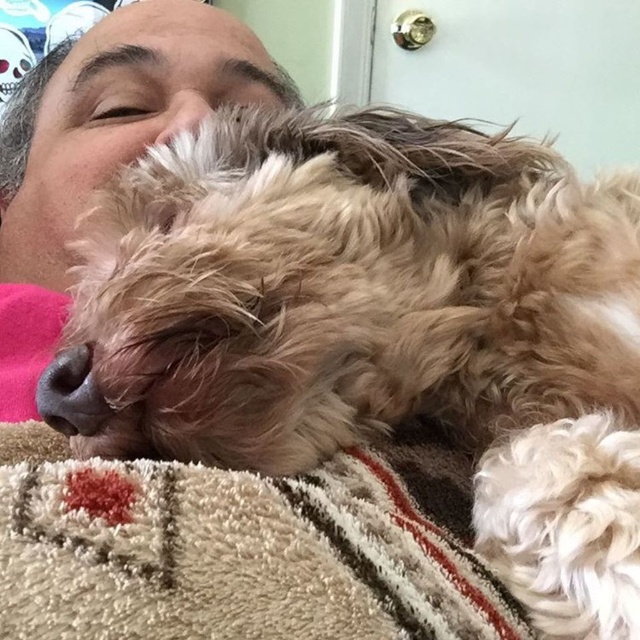
Can you confirm if white soft blanket at lower center is shorter than matte pink fabric at left?

Indeed, white soft blanket at lower center has a lesser height compared to matte pink fabric at left.

Does white soft blanket at lower center have a greater height compared to matte pink fabric at left?

In fact, white soft blanket at lower center may be shorter than matte pink fabric at left.

Is point (196, 497) positioned in front of point (218, 58)?

Yes, it is in front of point (218, 58).

You are a GUI agent. You are given a task and a screenshot of the screen. Output one action in this format:
    pyautogui.click(x=<x>, y=<y>)
    Task: Click on the white soft blanket at lower center
    The height and width of the screenshot is (640, 640).
    Given the screenshot: What is the action you would take?
    pyautogui.click(x=241, y=548)